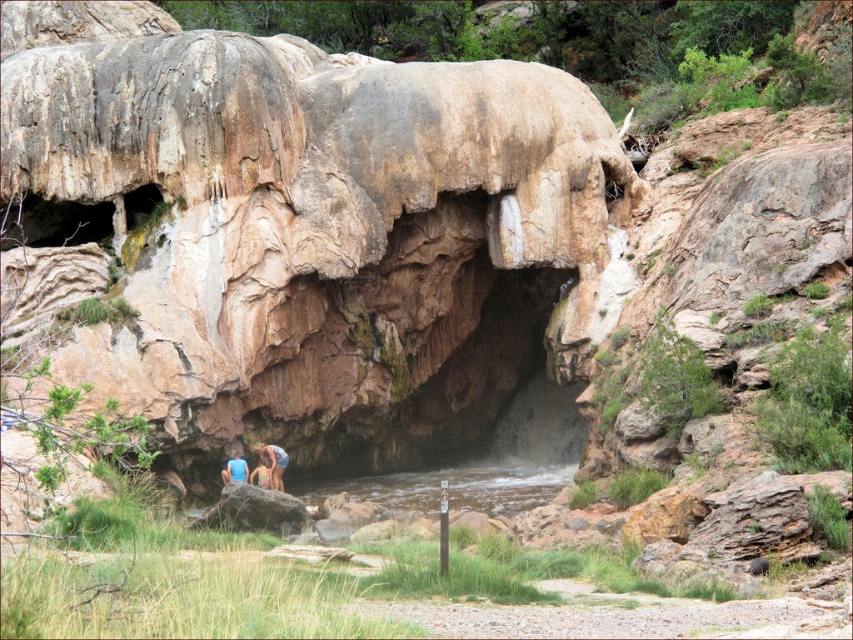
Question: Which object is the farthest from the blue fabric person at center?

Choices:
 (A) rustic stone cave at center
 (B) clear water at stream center

Answer: (A)

Question: Observing the image, what is the correct spatial positioning of rustic stone cave at center in reference to blue fabric person at center?

Choices:
 (A) below
 (B) above

Answer: (B)

Question: Which is nearer to the blue fabric person at center?

Choices:
 (A) smooth skin couple at center
 (B) clear water at stream center

Answer: (A)

Question: Is blue fabric person at center to the left of blue fabric at lower center from the viewer's perspective?

Choices:
 (A) yes
 (B) no

Answer: (B)

Question: Which point is closer to the camera taking this photo?

Choices:
 (A) (280, 451)
 (B) (242, 481)
 (C) (125, 10)
 (D) (509, 468)

Answer: (B)

Question: In this image, where is rustic stone cave at center located relative to smooth skin couple at center?

Choices:
 (A) below
 (B) above

Answer: (B)